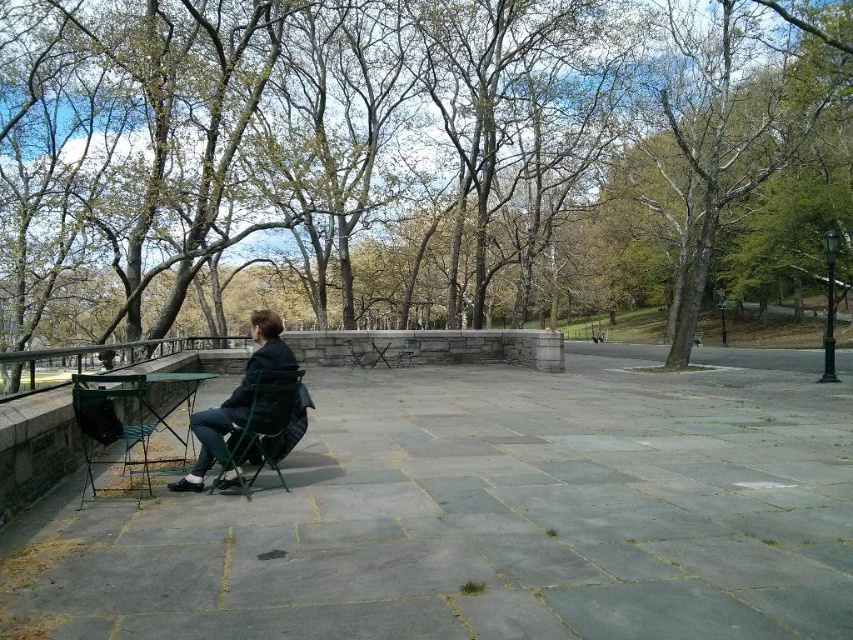
Does point (486, 221) lie behind point (347, 352)?

Yes, point (486, 221) is behind point (347, 352).

Consider the image. Between brown leafy tree at center and green fabric chair at center, which one appears on the right side from the viewer's perspective?

From the viewer's perspective, brown leafy tree at center appears more on the right side.

Does point (264, 177) come closer to viewer compared to point (360, 349)?

Yes, it is in front of point (360, 349).

You are a GUI agent. You are given a task and a screenshot of the screen. Output one action in this format:
    pyautogui.click(x=<x>, y=<y>)
    Task: Click on the brown leafy tree at center
    The width and height of the screenshot is (853, 640).
    Given the screenshot: What is the action you would take?
    pyautogui.click(x=416, y=157)

Does brown leafy tree at center appear on the right side of green fabric chair at left?

Yes, brown leafy tree at center is to the right of green fabric chair at left.

Is brown leafy tree at center further to the viewer compared to green fabric chair at left?

No, it is in front of green fabric chair at left.

Is point (595, 129) positioned behind point (294, 381)?

That is True.

In order to click on brown leafy tree at center in this screenshot , I will do (x=416, y=157).

Can you confirm if dark gray fabric jacket at center-left is positioned above green fabric chair at center?

No.

Is point (236, 390) positioned after point (347, 344)?

No, (236, 390) is closer to viewer.

Identify the location of dark gray fabric jacket at center-left. The height and width of the screenshot is (640, 853). (244, 404).